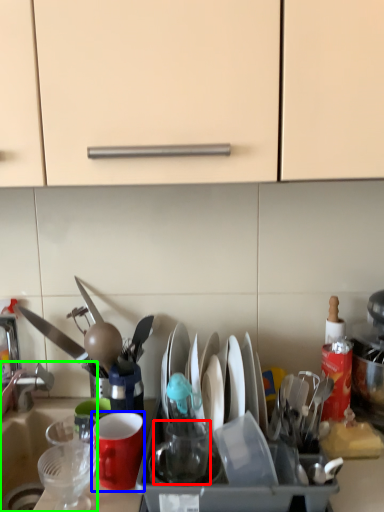
Question: Which object is positioned closest to tableware (highlighted by a red box)? Select from coffee cup (highlighted by a blue box) and sink (highlighted by a green box).

Choices:
 (A) coffee cup
 (B) sink

Answer: (A)